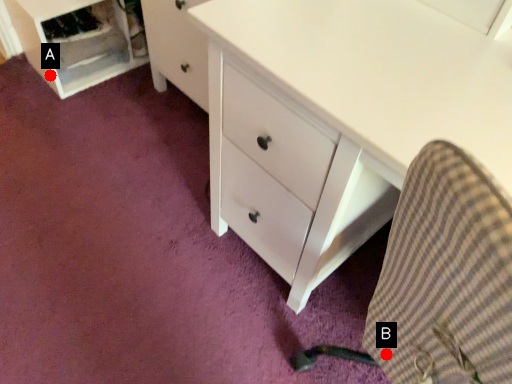
Question: Two points are circled on the image, labeled by A and B beside each circle. Which point is closer to the camera?

Choices:
 (A) A is closer
 (B) B is closer

Answer: (B)